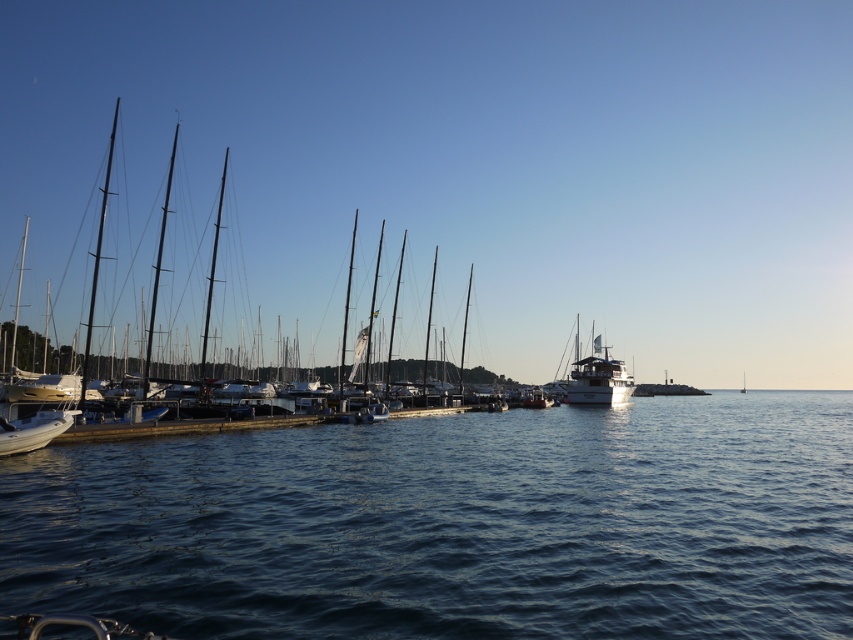
You are an observer standing on the pier and see the white glossy yacht at center and the white glossy sailboat at center. Which vessel has a taller mast?

The white glossy yacht at center has a much taller mast than the white glossy sailboat at center.

You are planning to take a short trip with your family. You see the white glossy yacht at center and the white glossy boat at lower left. Which one can accommodate more passengers?

The white glossy yacht at center has a larger size compared to the white glossy boat at lower left, so it can accommodate more passengers.

You are standing at the edge of the marina and want to locate two specific points in the scene. The first point is at coordinates point (369, 596) and the second is at point (7, 428). Which point is nearer to you?

Point (369, 596) is closer to the viewer than point (7, 428).